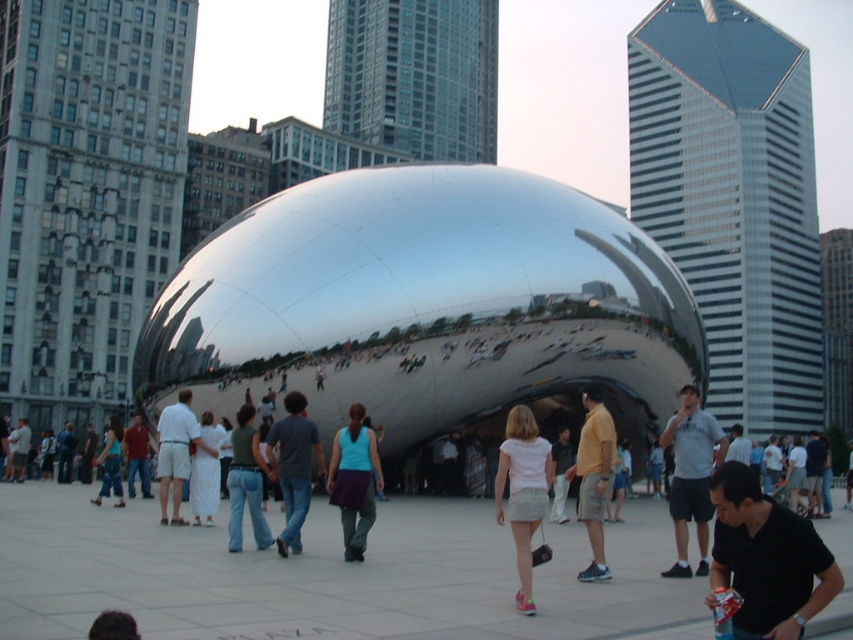
Question: Which is farther from the white cotton shirt at center?

Choices:
 (A) jeans at center
 (B) matte gray shirt at center
 (C) gray cotton shirt at center

Answer: (B)

Question: Is white matte shorts at center positioned at the back of white cotton shirt at center?

Choices:
 (A) no
 (B) yes

Answer: (A)

Question: Which point appears farthest from the camera in this image?

Choices:
 (A) [270, 531]
 (B) [587, 458]
 (C) [498, 506]

Answer: (A)

Question: Which is nearer to the black matte shirt at lower right?

Choices:
 (A) gray cotton shirt at center
 (B) white matte shorts at center

Answer: (B)

Question: Can you confirm if white matte shorts at center is positioned to the left of yellow matte shirt at center?

Choices:
 (A) no
 (B) yes

Answer: (B)

Question: Is matte gray shirt at center thinner than matte blue tank top at center?

Choices:
 (A) yes
 (B) no

Answer: (B)